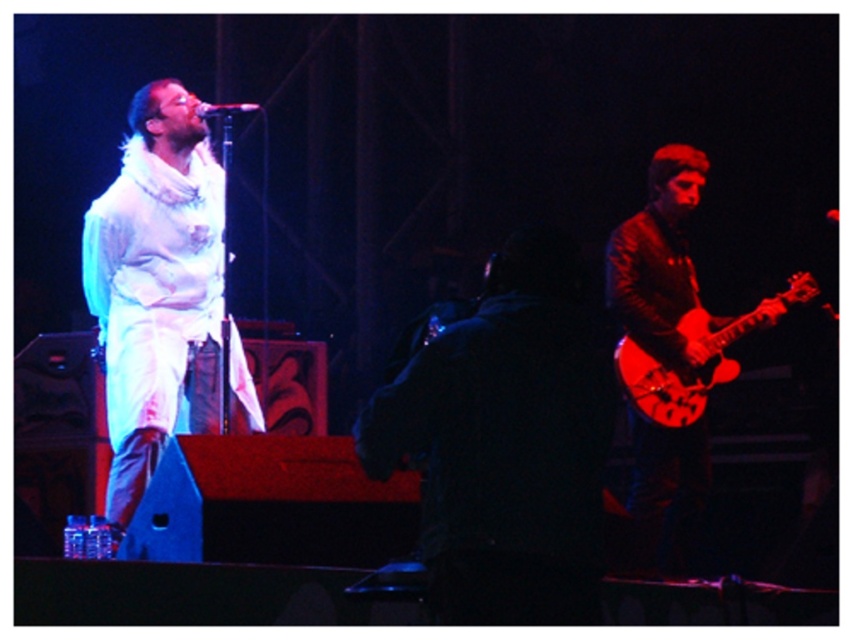
Question: Considering the real-world distances, which object is farthest from the white cotton shirt at left?

Choices:
 (A) glossy wood guitar at right
 (B) shiny brown leather guitar at right

Answer: (A)

Question: Among these points, which one is farthest from the camera?

Choices:
 (A) 231,369
 (B) 647,417

Answer: (B)

Question: From the image, what is the correct spatial relationship of shiny brown leather guitar at right in relation to metallic silver microphone at upper center?

Choices:
 (A) above
 (B) below

Answer: (B)

Question: Can you confirm if white cotton shirt at left is positioned below glossy wood guitar at right?

Choices:
 (A) yes
 (B) no

Answer: (B)

Question: Does white cotton shirt at left appear under metallic silver microphone at upper center?

Choices:
 (A) yes
 (B) no

Answer: (A)

Question: Based on their relative distances, which object is farther from the metallic silver microphone at upper center?

Choices:
 (A) shiny brown leather guitar at right
 (B) glossy wood guitar at right

Answer: (B)